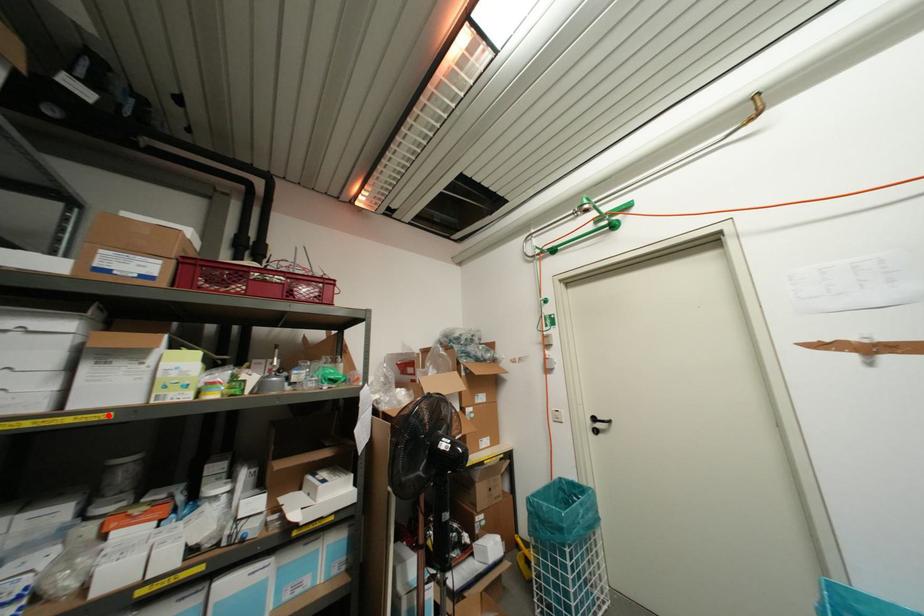
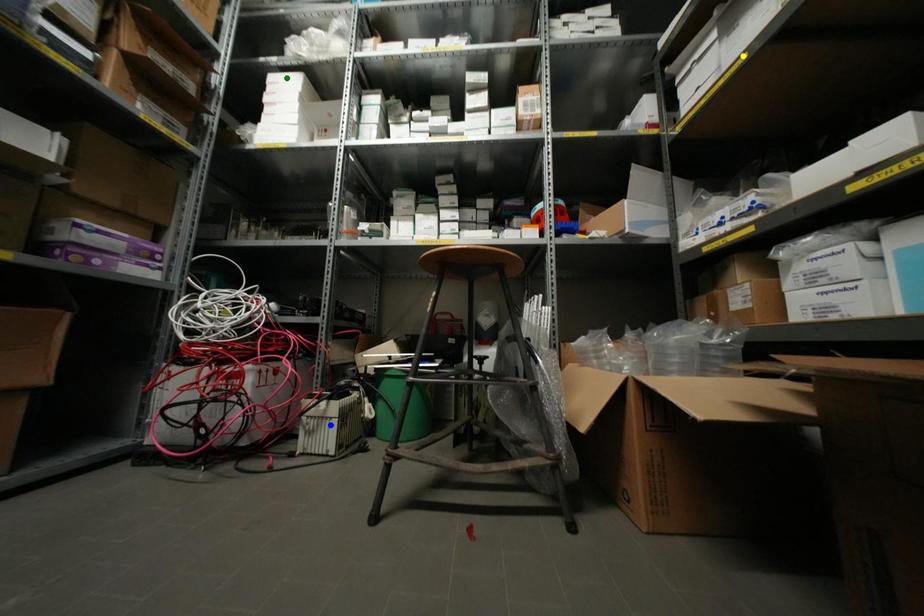
Question: I am providing you with two images of the same scene from different viewpoints. A red point is marked on the first image. You are given multiple points on the second image. In image 2, which mark is for the same physical point as the one in image 1?

Choices:
 (A) green point
 (B) blue point
 (C) yellow point

Answer: (C)